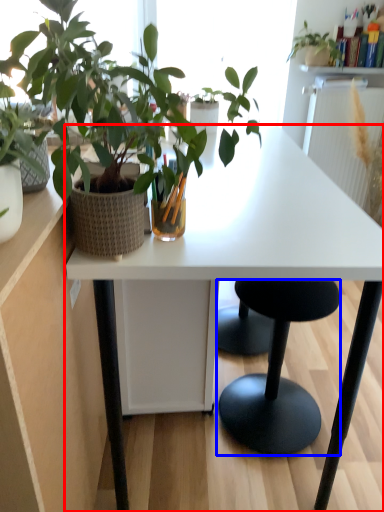
Question: Which of the following is the closest to the observer, desk (highlighted by a red box) or stool (highlighted by a blue box)?

Choices:
 (A) desk
 (B) stool

Answer: (A)